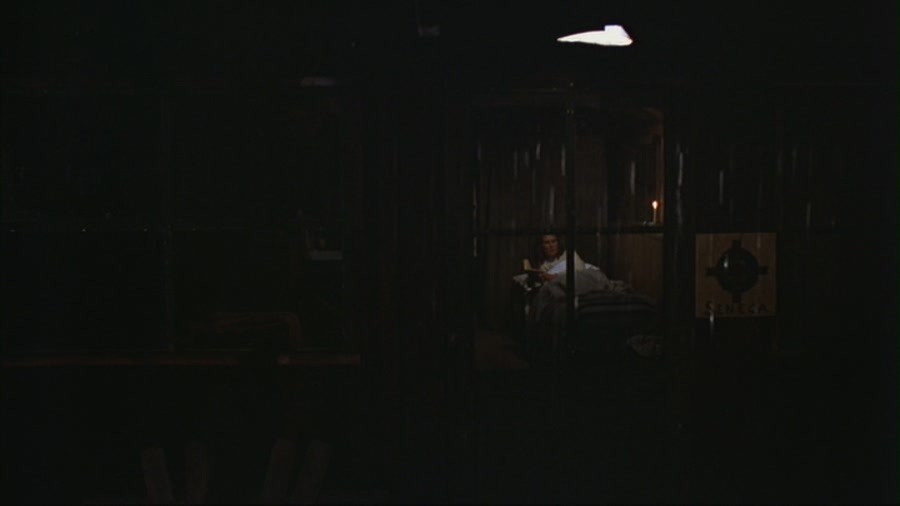
I want to click on blanket, so click(x=595, y=285).